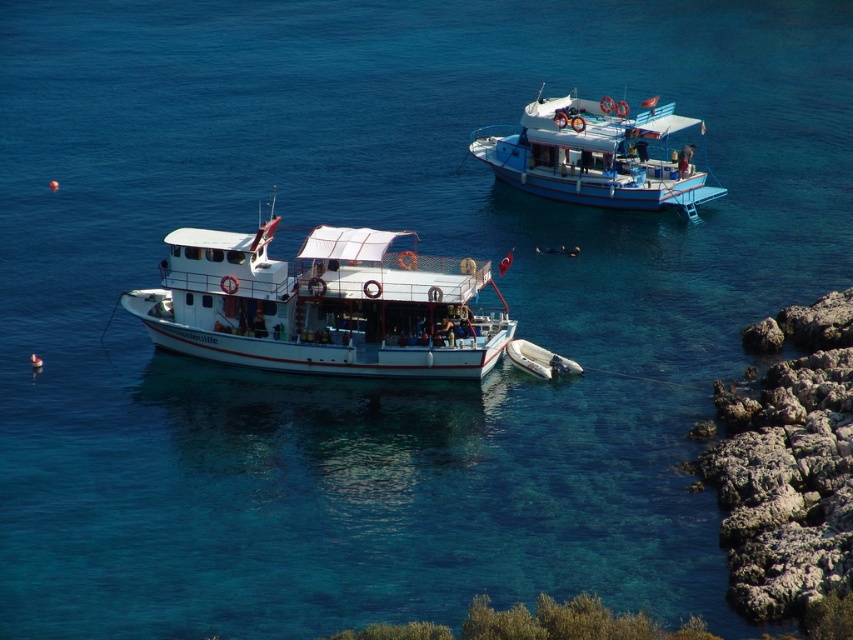
Does white matte boat at center have a greater width compared to blue painted wooden boat at upper right?

Correct, the width of white matte boat at center exceeds that of blue painted wooden boat at upper right.

Does point (344, 256) come farther from viewer compared to point (659, 193)?

No.

Identify the location of white matte boat at center. The height and width of the screenshot is (640, 853). (322, 305).

Does rockyrough/crumblyrocky outcrop at right come behind blue painted wooden boat at upper right?

No.

Between rockyrough/crumblyrocky outcrop at right and blue painted wooden boat at upper right, which one appears on the left side from the viewer's perspective?

blue painted wooden boat at upper right is more to the left.

Where is `rockyrough/crumblyrocky outcrop at right`? rockyrough/crumblyrocky outcrop at right is located at coordinates (788, 465).

Identify the location of rockyrough/crumblyrocky outcrop at right. The image size is (853, 640). (788, 465).

Who is positioned more to the left, white matte boat at center or rockyrough/crumblyrocky outcrop at right?

white matte boat at center is more to the left.

Does white matte boat at center appear on the left side of rockyrough/crumblyrocky outcrop at right?

Yes, white matte boat at center is to the left of rockyrough/crumblyrocky outcrop at right.

Does point (177, 323) come in front of point (810, 484)?

No, it is not.

The image size is (853, 640). Identify the location of white matte boat at center. (322, 305).